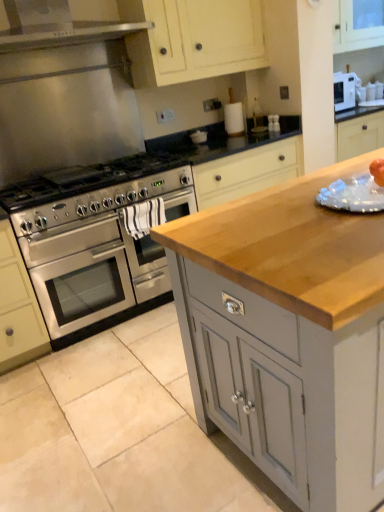
Question: Is matte cream cabinet at upper center, which is counted as the 2th cabinetry, starting from the bottom, situated inside stainless steel oven at left or outside?

Choices:
 (A) inside
 (B) outside

Answer: (B)

Question: Considering the positions of point (218, 12) and point (145, 295), is point (218, 12) closer or farther from the camera than point (145, 295)?

Choices:
 (A) closer
 (B) farther

Answer: (B)

Question: Which object is positioned farthest from the stainless steel oven at left?

Choices:
 (A) stainless steel gas stove at left
 (B) matte cream cabinet at upper center, which is the first cabinetry from back to front
 (C) wooden countertop at center, which is the first cabinetry in front-to-back order

Answer: (C)

Question: Considering the real-world distances, which object is closest to the wooden countertop at center, which is the first cabinetry in front-to-back order?

Choices:
 (A) matte cream cabinet at upper center, which is the first cabinetry from back to front
 (B) stainless steel gas stove at left
 (C) stainless steel oven at left

Answer: (C)